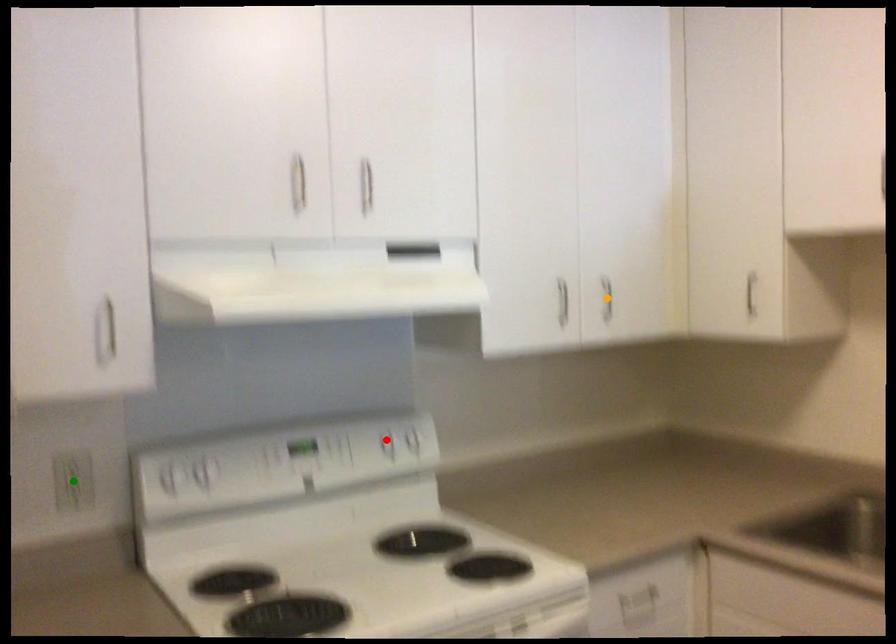
Order these from farthest to nearest:
green point | orange point | red point

1. orange point
2. red point
3. green point